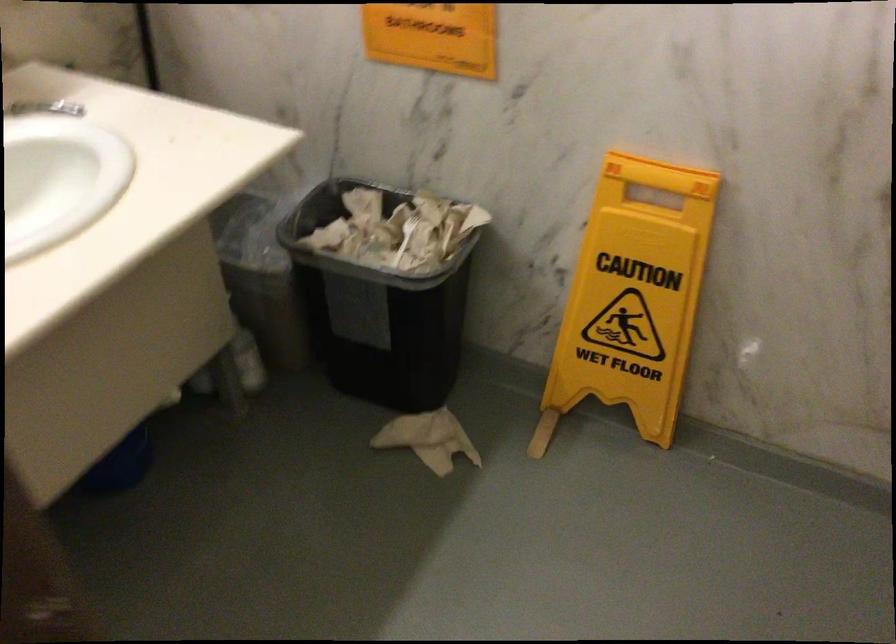
Where is `yellow sign handle`? Image resolution: width=896 pixels, height=644 pixels. yellow sign handle is located at coordinates (659, 175).